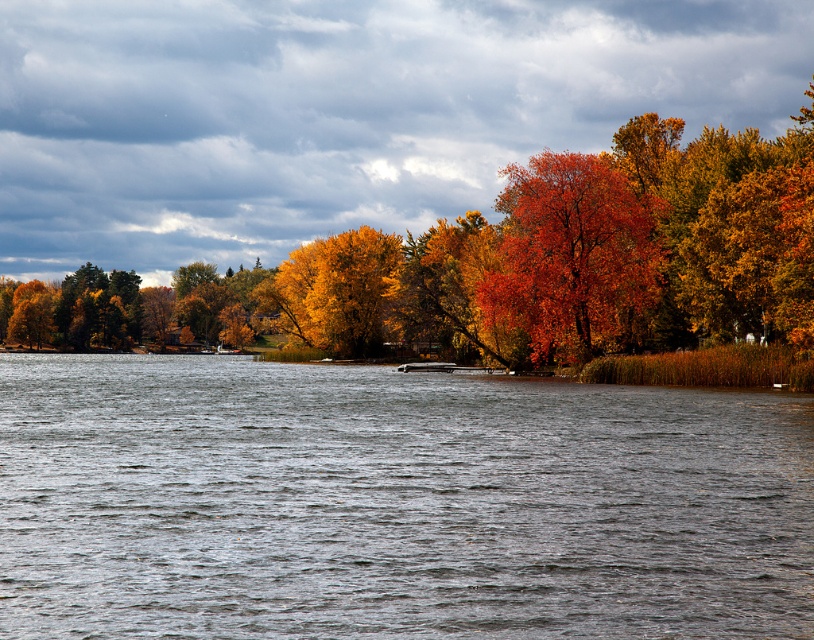
You are standing at the lakeside and see the gray water at center and the vivid orange leaves at center. Which object is closer to the ground?

The gray water at center is closer to the ground because it is positioned below the vivid orange leaves at center.

You are an artist planning to paint the scene. You have two main elements to focus on in the center of the image. Which object is smaller in size between the gray water at center and the vivid orange leaves at center?

The gray water at center has a smaller size compared to the vivid orange leaves at center, so the gray water at center is the smaller one.